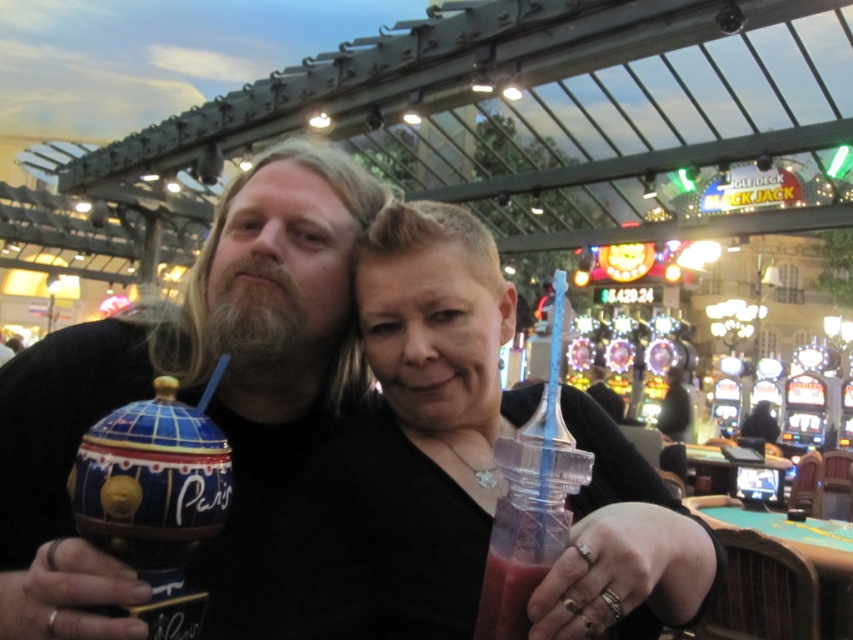
Question: Is matte ceramic cup at center to the left of smoothie at right from the viewer's perspective?

Choices:
 (A) no
 (B) yes

Answer: (B)

Question: Which point is closer to the camera?

Choices:
 (A) (500, 602)
 (B) (328, 262)

Answer: (A)

Question: Which object is farther from the camera taking this photo?

Choices:
 (A) matte ceramic cup at center
 (B) smoothie at right

Answer: (A)

Question: Which point is closer to the camera?

Choices:
 (A) smoothie at right
 (B) matte ceramic cup at center

Answer: (A)

Question: Does matte ceramic cup at center appear on the right side of smoothie at right?

Choices:
 (A) no
 (B) yes

Answer: (A)

Question: Is matte ceramic cup at center to the right of smoothie at right from the viewer's perspective?

Choices:
 (A) yes
 (B) no

Answer: (B)